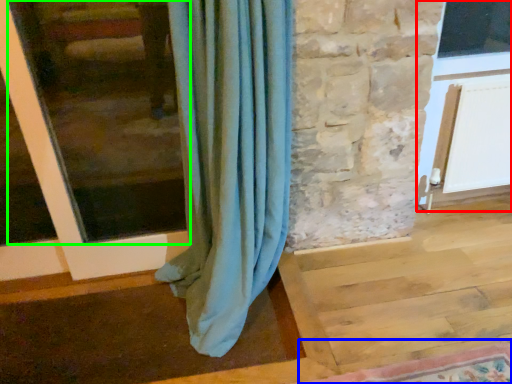
Question: Based on their relative distances, which object is nearer to screen door (highlighted by a red box)? Choose from mat (highlighted by a blue box) and window frame (highlighted by a green box).

Choices:
 (A) mat
 (B) window frame

Answer: (A)